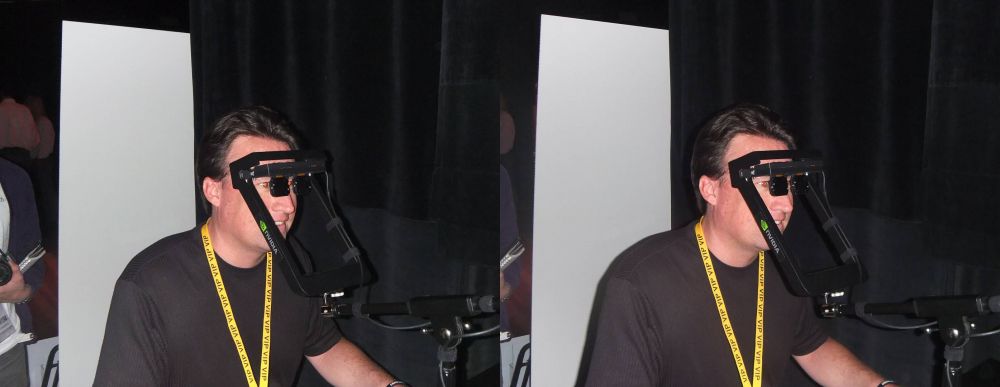
Identify the location of curtain. (389, 84).